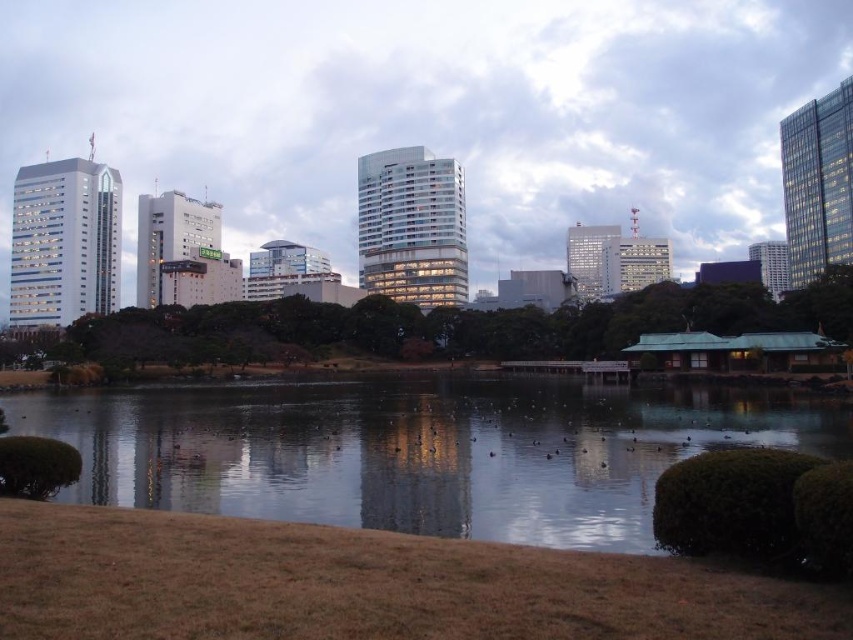
Question: Is matte glass buildings at center below clear water at center?

Choices:
 (A) no
 (B) yes

Answer: (A)

Question: Which point appears farthest from the camera in this image?

Choices:
 (A) (74, 1)
 (B) (672, 449)

Answer: (A)

Question: Is matte glass buildings at center wider than clear water at center?

Choices:
 (A) no
 (B) yes

Answer: (B)

Question: Does matte glass buildings at center have a greater width compared to clear water at center?

Choices:
 (A) yes
 (B) no

Answer: (A)